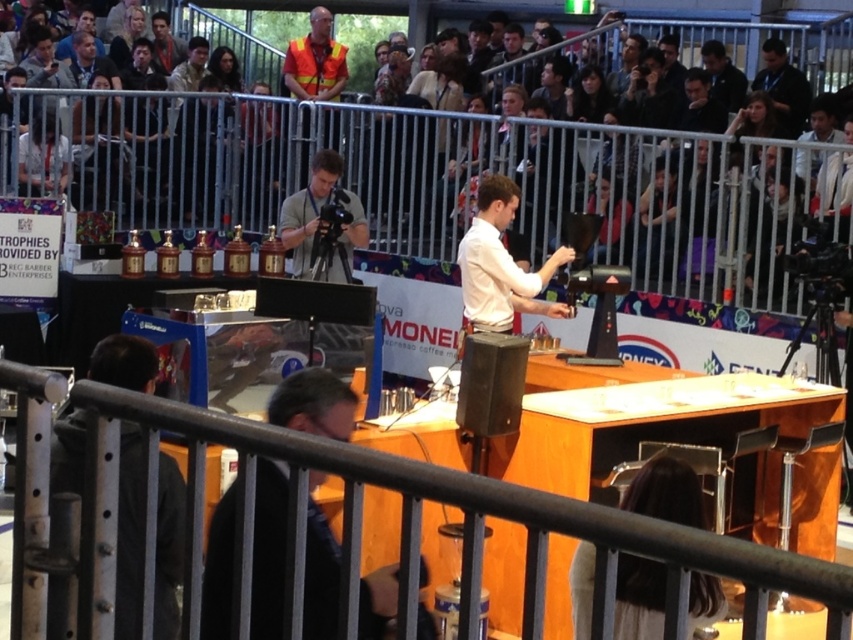
Is dark brown hair at lower center in front of white glossy shirt at center?

Yes.

At what (x,y) coordinates should I click in order to perform the action: click on dark brown hair at lower center. Please return your answer as a coordinate pair (x, y). Looking at the image, I should click on (666, 492).

Is dark gray fabric seats at upper center closer to the viewer compared to black shirt at upper right?

Yes, dark gray fabric seats at upper center is closer to the viewer.

Who is positioned more to the left, dark gray fabric seats at upper center or black shirt at upper right?

dark gray fabric seats at upper center

Where is `dark gray fabric seats at upper center`? Image resolution: width=853 pixels, height=640 pixels. dark gray fabric seats at upper center is located at coordinates (440, 179).

Based on the photo, can you confirm if gray fabric camera at center is positioned to the left of dark blue shirt at upper right?

Correct, you'll find gray fabric camera at center to the left of dark blue shirt at upper right.

Where is `gray fabric camera at center`? This screenshot has height=640, width=853. gray fabric camera at center is located at coordinates (308, 209).

What do you see at coordinates (308, 209) in the screenshot? I see `gray fabric camera at center` at bounding box center [308, 209].

I want to click on gray fabric camera at center, so click(308, 209).